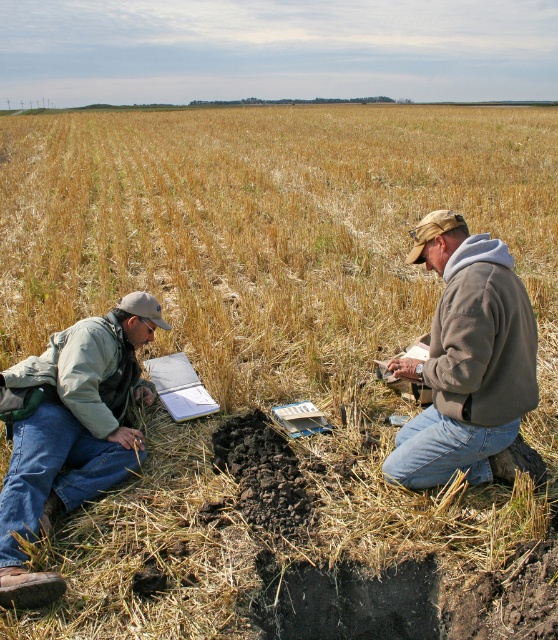
Measure the distance from denim jeans at lower left to brown fleece jacket at right.

They are 1.99 meters apart.

Locate an element on the screen. The height and width of the screenshot is (640, 558). denim jeans at lower left is located at coordinates (69, 429).